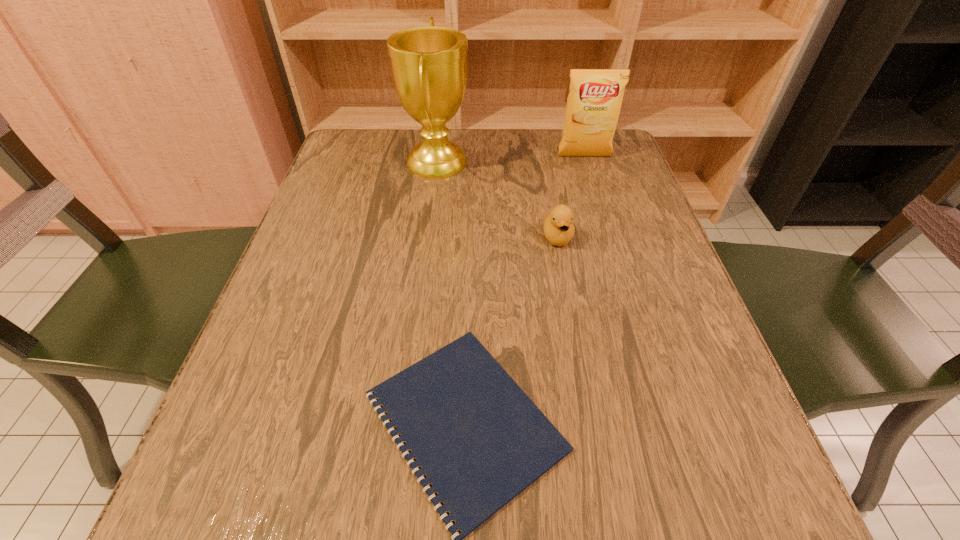
Locate an element on the screen. The image size is (960, 540). award is located at coordinates (429, 64).

Image resolution: width=960 pixels, height=540 pixels. What are the coordinates of `crisp (potato chip)` in the screenshot? It's located at (593, 106).

Where is `the second tallest object`? the second tallest object is located at coordinates (593, 106).

Locate an element on the screen. The image size is (960, 540). the second nearest object is located at coordinates (558, 226).

Where is `duckling`? The height and width of the screenshot is (540, 960). duckling is located at coordinates (558, 226).

Identify the location of vacant space located 0.350m on the shiny surface of the tallest object. (609, 161).

You are a GUI agent. You are given a task and a screenshot of the screen. Output one action in this format:
    pyautogui.click(x=<x>, y=<y>)
    Task: Click on the free region located 0.110m on the front of the third shortest object with the logo
    
    Given the screenshot: What is the action you would take?
    pyautogui.click(x=593, y=186)

Image resolution: width=960 pixels, height=540 pixels. I want to click on vacant space situated on the face of the duckling, so click(x=584, y=375).

The image size is (960, 540). I want to click on award that is at the far edge, so click(x=429, y=64).

The width and height of the screenshot is (960, 540). I want to click on crisp (potato chip) that is at the far edge, so click(x=593, y=106).